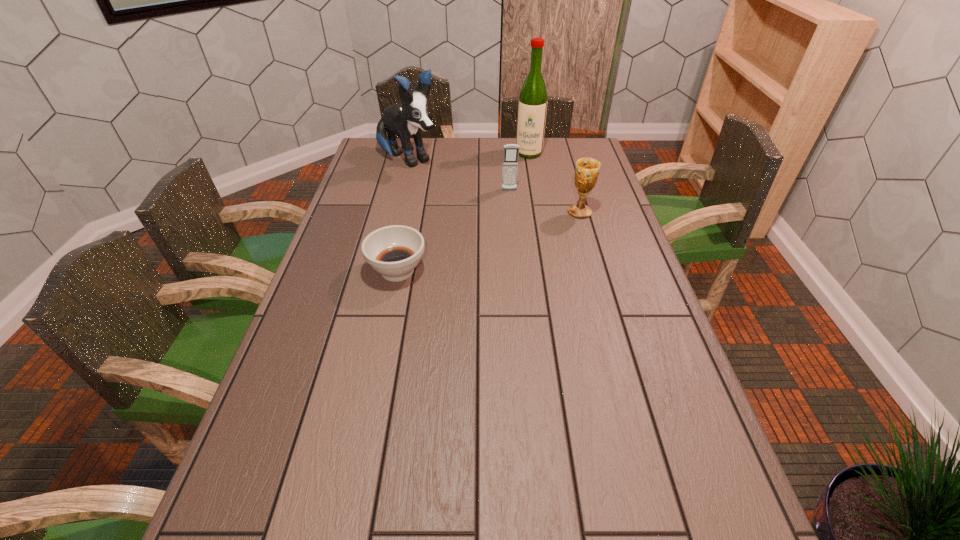
Locate an element on the screen. The height and width of the screenshot is (540, 960). blank space located on the front-facing side of the third object from right to left is located at coordinates (516, 262).

Identify the location of free point located on the front-facing side of the third object from right to left. The image size is (960, 540). (516, 267).

This screenshot has height=540, width=960. I want to click on free space located 0.140m on the front-facing side of the third object from right to left, so click(x=512, y=215).

Where is `vacant space located on the label of the fourth object from left to right`? vacant space located on the label of the fourth object from left to right is located at coordinates (516, 204).

Where is `vacant space located 0.080m on the label of the fourth object from left to right`? Image resolution: width=960 pixels, height=540 pixels. vacant space located 0.080m on the label of the fourth object from left to right is located at coordinates (525, 170).

Where is `vacant space located on the label of the fourth object from left to right`? vacant space located on the label of the fourth object from left to right is located at coordinates (523, 176).

Identify the location of free point located on the front-facing side of the puppy. Image resolution: width=960 pixels, height=540 pixels. (456, 193).

Locate an element on the screen. blank area located on the front-facing side of the puppy is located at coordinates (447, 187).

The image size is (960, 540). Find the location of `free region located on the front-facing side of the puppy`. free region located on the front-facing side of the puppy is located at coordinates (438, 181).

Identify the location of liquor that is at the far edge. Image resolution: width=960 pixels, height=540 pixels. (532, 106).